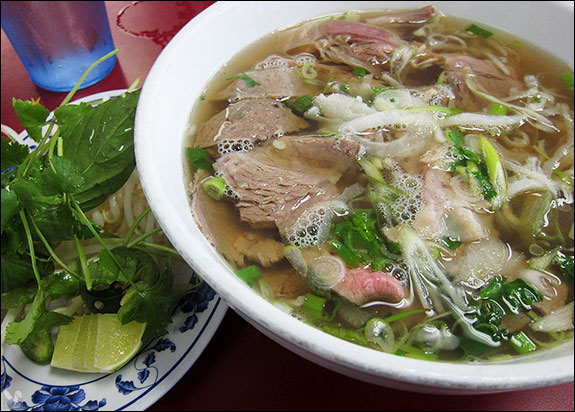
You are a GUI agent. You are given a task and a screenshot of the screen. Output one action in this format:
    pyautogui.click(x=<x>, y=<y>)
    Task: Click on the red tabletop
    The height and width of the screenshot is (412, 575).
    Given the screenshot: What is the action you would take?
    point(7,74), point(321,389), point(551,393)